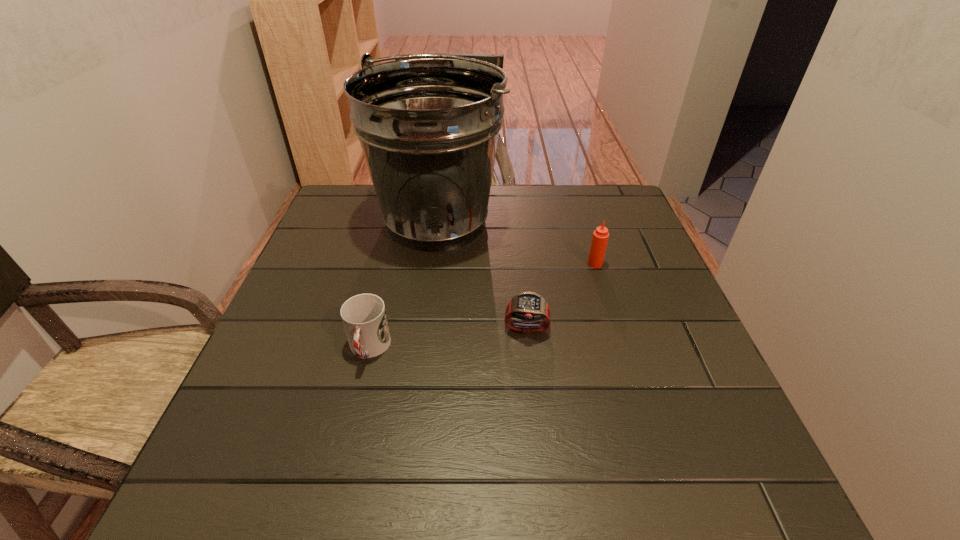
Locate an element on the screen. Image resolution: width=960 pixels, height=540 pixels. bucket is located at coordinates (428, 127).

The width and height of the screenshot is (960, 540). What are the coordinates of `Tabasco sauce` in the screenshot? It's located at (600, 237).

Identify the location of the second tallest object. (600, 237).

You are a GUI agent. You are given a task and a screenshot of the screen. Output one action in this format:
    pyautogui.click(x=<x>, y=<y>)
    Task: Click on the third tallest object
    Image resolution: width=960 pixels, height=540 pixels.
    Given the screenshot: What is the action you would take?
    pyautogui.click(x=364, y=318)

Where is `watch`? watch is located at coordinates (528, 306).

This screenshot has width=960, height=540. What are the coordinates of `vacant space located on the right of the bucket` in the screenshot? It's located at (583, 222).

Locate an element on the screen. vacant region located on the left of the third shortest object is located at coordinates (520, 264).

Image resolution: width=960 pixels, height=540 pixels. In order to click on free space located 0.060m on the handle side of the cup in this screenshot , I will do `click(356, 400)`.

Identify the location of free spot located 0.290m on the right of the watch. The image size is (960, 540). (684, 329).

Locate an element on the screen. The width and height of the screenshot is (960, 540). object situated at the far edge is located at coordinates (428, 127).